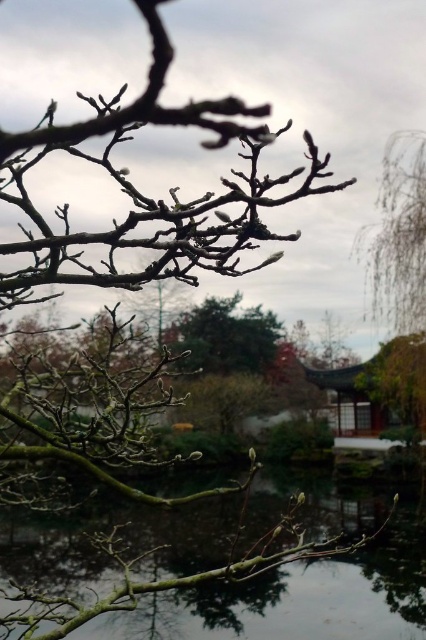
You are a bird that needs to land on a branch. You see the bare branches at upper center and the green matte tree branch at center. Which branch is closer to you?

The green matte tree branch at center is closer to you because the bare branches at upper center is 1.34 meters away from it.

You are an arborist examining the tree branches in the image. Which of the two branches, the bare branches at upper center or the green matte tree branch at center, is closer to the ground?

The green matte tree branch at center is closer to the ground because the bare branches at upper center is positioned over it.